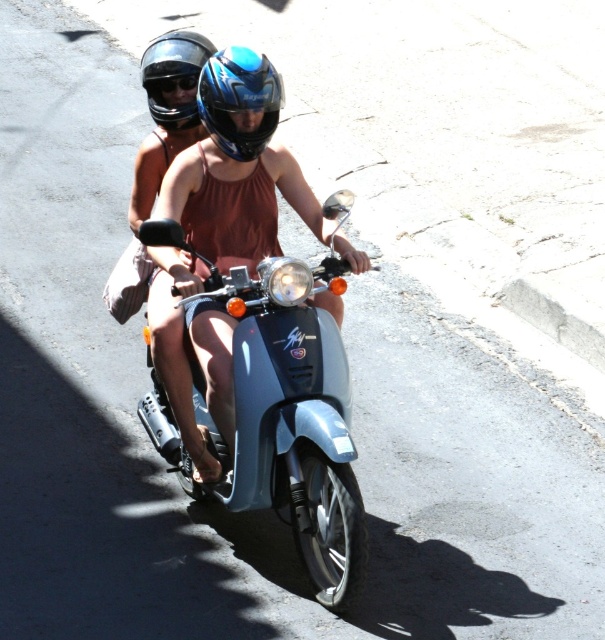
You are a safety inspector checking the helmets and goggles of the riders. Which object has a larger size between the glossy blue helmet at center and the black matte goggles at upper center?

The glossy blue helmet at center has a larger size compared to the black matte goggles at upper center.

What are the coordinates of the metallic blue scooter at center?

The metallic blue scooter at center is located at point (281, 413).

Looking at this image, you are standing at the origin point in the image. The metallic blue scooter at center is at coordinates 0.647 on the x and 0.466 on the y. If you want to move towards the scooter, which direction should you go?

The metallic blue scooter at center is located at coordinates 0.647 on the x and 0.466 on the y. To move towards it from the origin, you should go northeast since the x and y values are both positive and greater than zero.